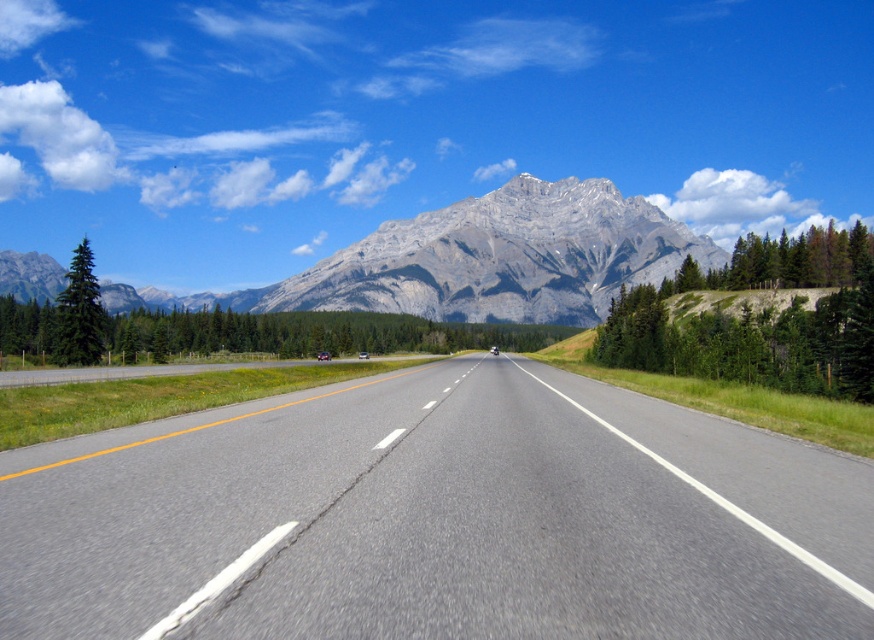
Question: Which of the following is the farthest from the observer?

Choices:
 (A) asphalt road at center
 (B) green textured tree at right
 (C) gray rocky mountain at center
 (D) green leafy tree at left

Answer: (C)

Question: Which of the following is the closest to the observer?

Choices:
 (A) asphalt road at center
 (B) green leafy tree at left
 (C) gray rocky mountain at center

Answer: (A)

Question: Among these points, which one is nearest to the camera?

Choices:
 (A) (760, 275)
 (B) (318, 588)

Answer: (B)

Question: Is the position of asphalt road at center less distant than that of green leafy tree at left?

Choices:
 (A) yes
 (B) no

Answer: (A)

Question: Can you confirm if gray rocky mountain at center is positioned above green leafy tree at left?

Choices:
 (A) no
 (B) yes

Answer: (B)

Question: Can you confirm if asphalt road at center is wider than green textured tree at right?

Choices:
 (A) yes
 (B) no

Answer: (B)